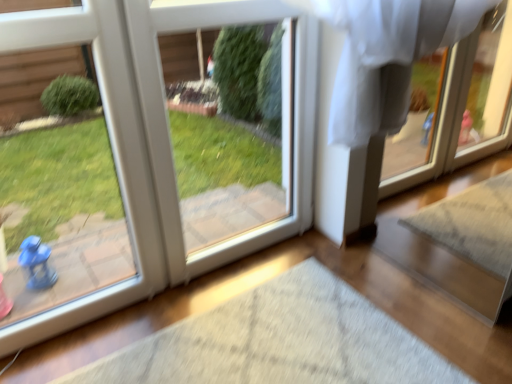
Question: Is white plastic screen door at center in front of or behind white glossy door at left in the image?

Choices:
 (A) behind
 (B) front

Answer: (A)

Question: From the image's perspective, is white plastic screen door at center above or below white glossy door at left?

Choices:
 (A) above
 (B) below

Answer: (A)

Question: In terms of size, does white plastic screen door at center appear bigger or smaller than white glossy door at left?

Choices:
 (A) small
 (B) big

Answer: (B)

Question: Is white glossy door at left to the left or to the right of white plastic screen door at center in the image?

Choices:
 (A) right
 (B) left

Answer: (B)

Question: Is point (148, 288) positioned closer to the camera than point (155, 6)?

Choices:
 (A) farther
 (B) closer

Answer: (A)

Question: Choose the correct answer: Is white glossy door at left inside white plastic screen door at center or outside it?

Choices:
 (A) inside
 (B) outside

Answer: (B)

Question: From a real-world perspective, is white glossy door at left physically located above or below white plastic screen door at center?

Choices:
 (A) below
 (B) above

Answer: (B)